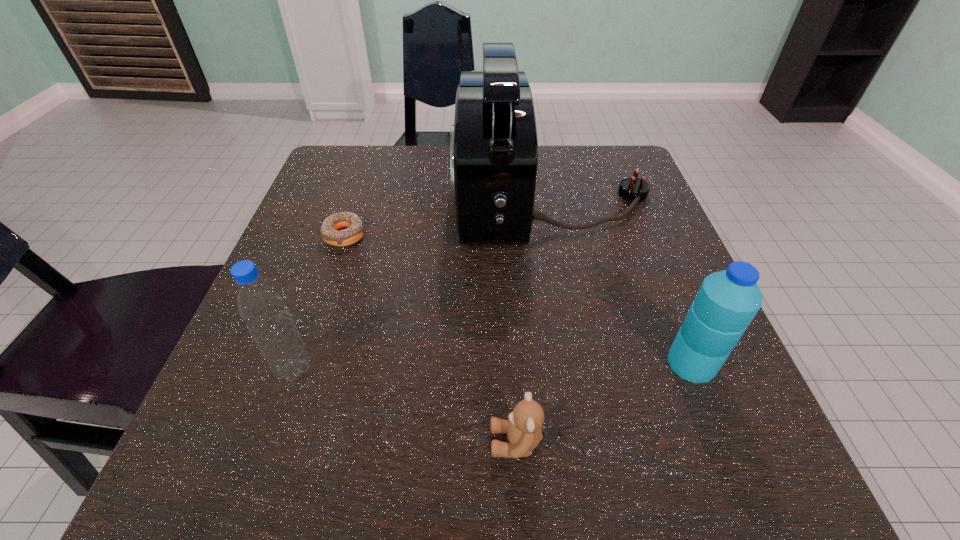
In order to click on vacant space located on the left of the right water bottle in this screenshot , I will do `click(540, 363)`.

This screenshot has height=540, width=960. I want to click on free space located 0.260m on the face of the teddy bear, so click(x=287, y=442).

The image size is (960, 540). In order to click on free region located 0.250m on the face of the teddy bear in this screenshot , I will do `click(295, 442)`.

You are a GUI agent. You are given a task and a screenshot of the screen. Output one action in this format:
    pyautogui.click(x=<x>, y=<y>)
    Task: Click on the vacant region located 0.050m on the face of the teddy bear
    
    Given the screenshot: What is the action you would take?
    pyautogui.click(x=451, y=442)

In order to click on vacant region located 0.070m on the right of the shortest object in this screenshot , I will do `click(402, 235)`.

Locate an element on the screen. Image resolution: width=960 pixels, height=540 pixels. object that is at the far edge is located at coordinates (493, 144).

Locate an element on the screen. object located at the near edge is located at coordinates (523, 428).

This screenshot has width=960, height=540. I want to click on water bottle located at the left edge, so click(260, 304).

Image resolution: width=960 pixels, height=540 pixels. Find the location of `doughnut that is at the left edge`. doughnut that is at the left edge is located at coordinates (355, 230).

This screenshot has height=540, width=960. Identify the location of radio receiver at the right edge. (493, 144).